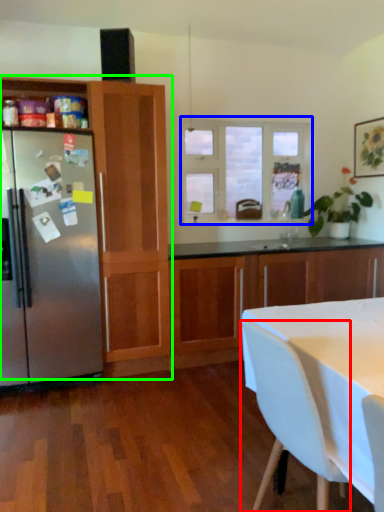
Question: Which object is the closest to the chair (highlighted by a red box)? Choose among these: window (highlighted by a blue box) or cabinetry (highlighted by a green box).

Choices:
 (A) window
 (B) cabinetry

Answer: (B)